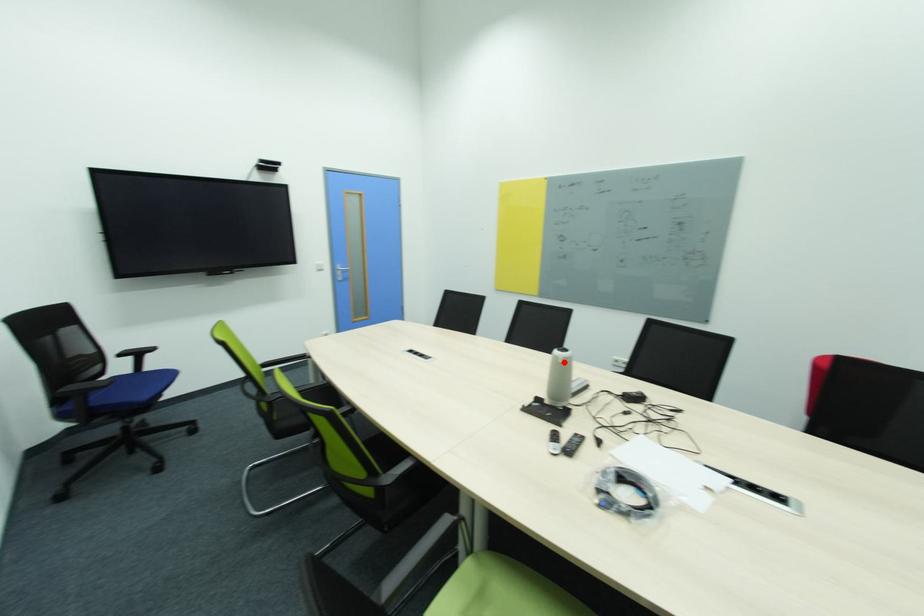
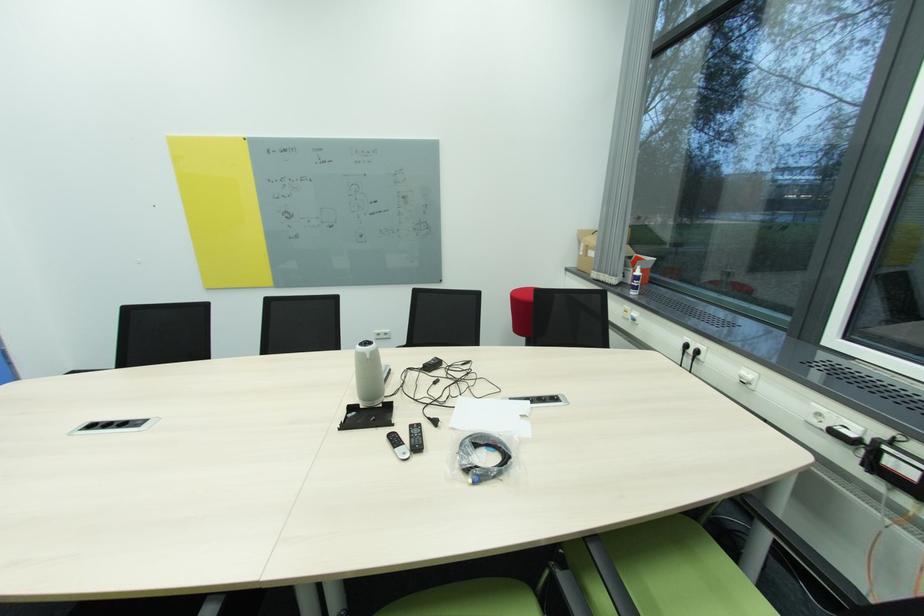
Question: I am providing you with two images of the same scene from different viewpoints. A red point is marked on the first image. At the location where the point appears in image 1, is it still visible in image 2?

Choices:
 (A) Yes
 (B) No

Answer: (A)